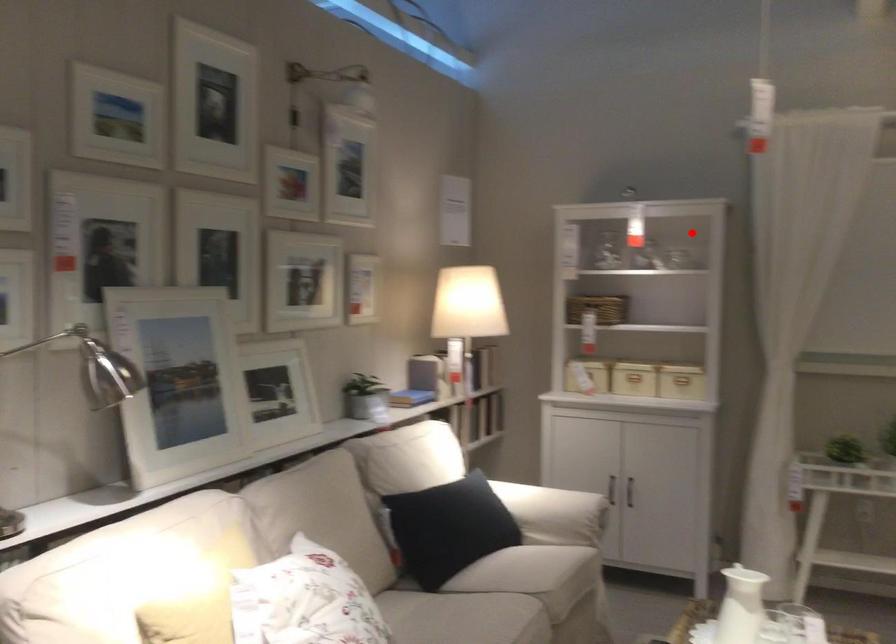
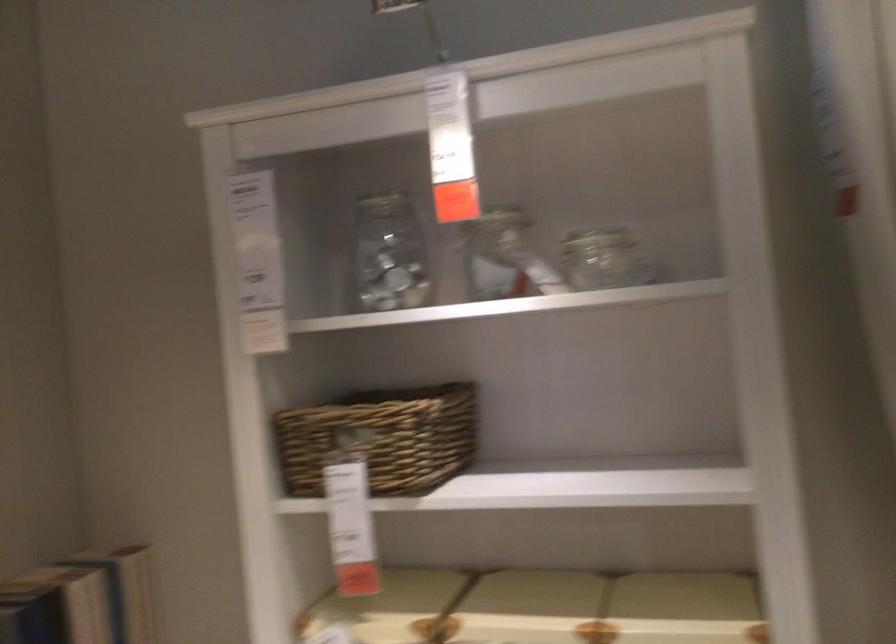
Question: A red point is marked in image1. In image2, is the corresponding 3D point closer to the camera or farther? Reply with the corresponding letter.

Choices:
 (A) The corresponding 3D point is closer.
 (B) The corresponding 3D point is farther.

Answer: (A)